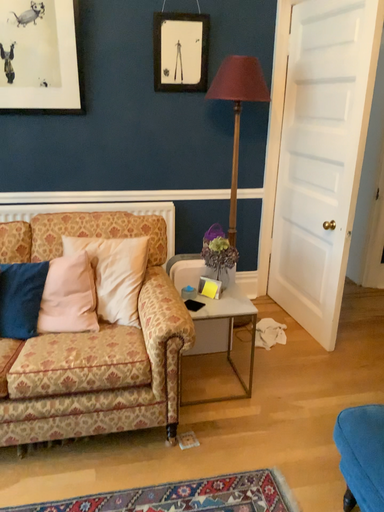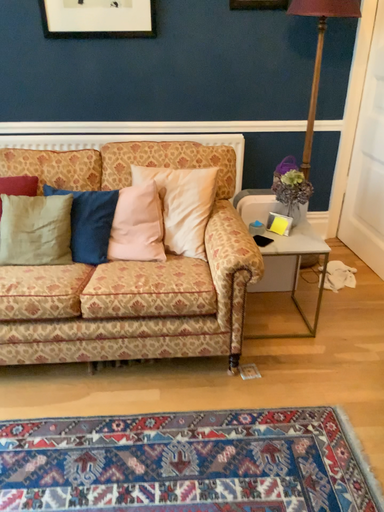
Question: Which way did the camera rotate in the video?

Choices:
 (A) rotated left
 (B) rotated right

Answer: (A)